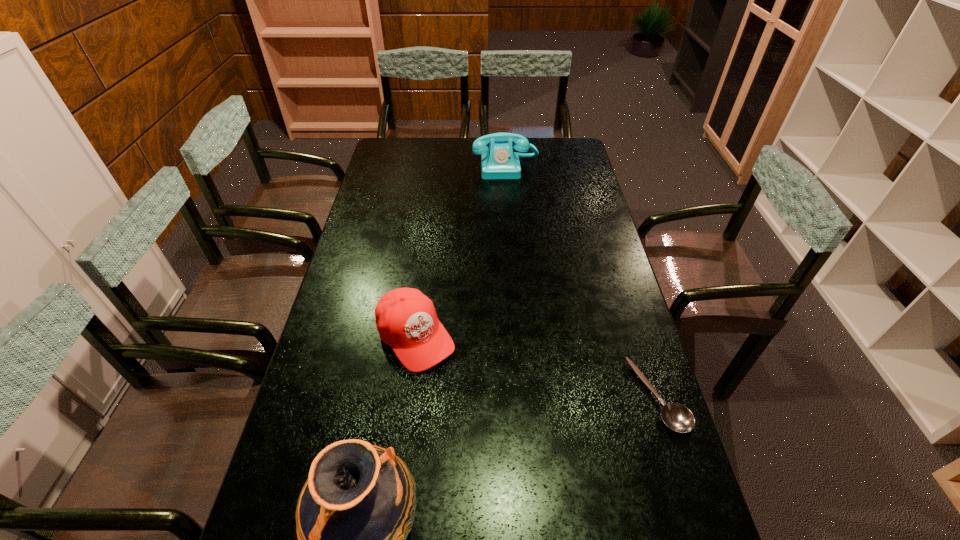
I want to click on free space that is in between the farthest object and the second shortest object, so click(x=461, y=252).

At what (x,y) coordinates should I click in order to perform the action: click on vacant area between the third object from left to right and the baseball cap. Please return your answer as a coordinate pair (x, y). The image size is (960, 540). Looking at the image, I should click on (461, 252).

You are a GUI agent. You are given a task and a screenshot of the screen. Output one action in this format:
    pyautogui.click(x=<x>, y=<y>)
    Task: Click on the third closest object relative to the nearest object
    This screenshot has width=960, height=540.
    Given the screenshot: What is the action you would take?
    pyautogui.click(x=499, y=161)

This screenshot has height=540, width=960. What are the coordinates of `object that ranks as the third closest to the ladle` in the screenshot? It's located at (499, 161).

Locate an element on the screen. vacant region that satisfies the following two spatial constraints: 1. on the front side of the third tallest object; 2. on the left side of the rightmost object is located at coordinates (408, 395).

The height and width of the screenshot is (540, 960). What are the coordinates of `vacant space that satisfies the following two spatial constraints: 1. on the back side of the baseball cap; 2. on the left side of the second tallest object` in the screenshot? It's located at (437, 167).

I want to click on blank space that satisfies the following two spatial constraints: 1. on the back side of the farthest object; 2. on the right side of the baseball cap, so (437, 167).